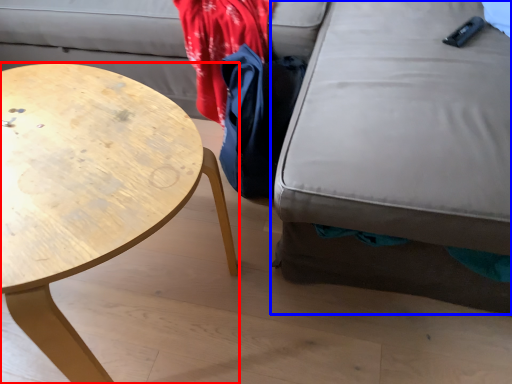
Question: Which of the following is the farthest to the observer, coffee table (highlighted by a red box) or swivel chair (highlighted by a blue box)?

Choices:
 (A) coffee table
 (B) swivel chair

Answer: (A)